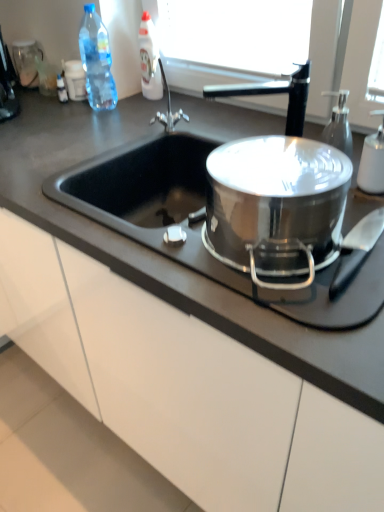
Question: Does white matte soap dispenser at right, the 1th bottle in the bottom-to-top sequence, have a larger size compared to white glossy bottle at upper center, acting as the first bottle starting from the back?

Choices:
 (A) yes
 (B) no

Answer: (B)

Question: From a real-world perspective, is white matte soap dispenser at right, which ranks as the 3th bottle in top-to-bottom order, located beneath white glossy bottle at upper center, the second bottle from the left?

Choices:
 (A) yes
 (B) no

Answer: (A)

Question: Is white matte soap dispenser at right, marked as the first bottle in a right-to-left arrangement, placed right next to white glossy bottle at upper center, acting as the first bottle starting from the back?

Choices:
 (A) yes
 (B) no

Answer: (B)

Question: From the image's perspective, is white matte soap dispenser at right, the third bottle viewed from the back, on top of white glossy bottle at upper center, acting as the first bottle starting from the back?

Choices:
 (A) yes
 (B) no

Answer: (B)

Question: Can you confirm if white matte soap dispenser at right, which is the third bottle from left to right, is shorter than white glossy bottle at upper center, the second bottle viewed from the right?

Choices:
 (A) no
 (B) yes

Answer: (B)

Question: From the image's perspective, is black plastic coffee machine at upper left above or below transparent plastic bottle at upper left, arranged as the first bottle when viewed from the left?

Choices:
 (A) above
 (B) below

Answer: (B)

Question: From a real-world perspective, is black plastic coffee machine at upper left positioned above or below transparent plastic bottle at upper left, the 2th bottle positioned from the top?

Choices:
 (A) above
 (B) below

Answer: (B)

Question: In the image, is black plastic coffee machine at upper left on the left side or the right side of transparent plastic bottle at upper left, placed as the 2th bottle when sorted from back to front?

Choices:
 (A) right
 (B) left

Answer: (B)

Question: In the image, is black plastic coffee machine at upper left positioned in front of or behind transparent plastic bottle at upper left, placed as the 2th bottle when sorted from back to front?

Choices:
 (A) front
 (B) behind

Answer: (A)

Question: In terms of width, does white matte soap dispenser at right, the third bottle viewed from the back, look wider or thinner when compared to transparent plastic bottle at upper left, arranged as the first bottle when viewed from the left?

Choices:
 (A) wide
 (B) thin

Answer: (B)

Question: Considering the positions of point (380, 137) and point (89, 65), is point (380, 137) closer or farther from the camera than point (89, 65)?

Choices:
 (A) farther
 (B) closer

Answer: (B)

Question: Visually, is white matte soap dispenser at right, the first bottle positioned from the front, positioned to the left or to the right of transparent plastic bottle at upper left, the 2th bottle positioned from the top?

Choices:
 (A) left
 (B) right

Answer: (B)

Question: Relative to transparent plastic bottle at upper left, the second bottle viewed from the front, is white matte soap dispenser at right, the third bottle viewed from the back, in front or behind?

Choices:
 (A) front
 (B) behind

Answer: (A)

Question: In terms of width, does white glossy bottle at upper center, which is counted as the third bottle, starting from the front, look wider or thinner when compared to white matte soap dispenser at right, the third bottle viewed from the back?

Choices:
 (A) thin
 (B) wide

Answer: (B)

Question: Considering the relative positions of white glossy bottle at upper center, the 3th bottle in the bottom-to-top sequence, and white matte soap dispenser at right, the 1th bottle in the bottom-to-top sequence, in the image provided, is white glossy bottle at upper center, the 3th bottle in the bottom-to-top sequence, to the left or to the right of white matte soap dispenser at right, the 1th bottle in the bottom-to-top sequence,?

Choices:
 (A) right
 (B) left

Answer: (B)